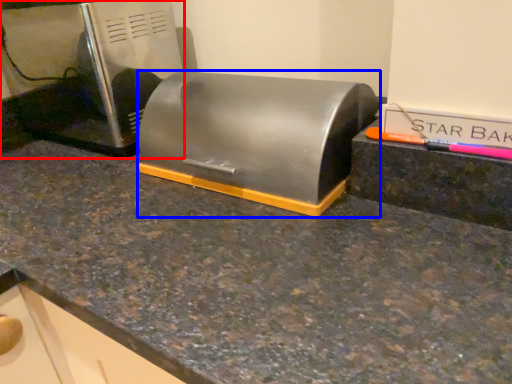
Question: Among these objects, which one is nearest to the camera, home appliance (highlighted by a red box) or appliance (highlighted by a blue box)?

Choices:
 (A) home appliance
 (B) appliance

Answer: (B)